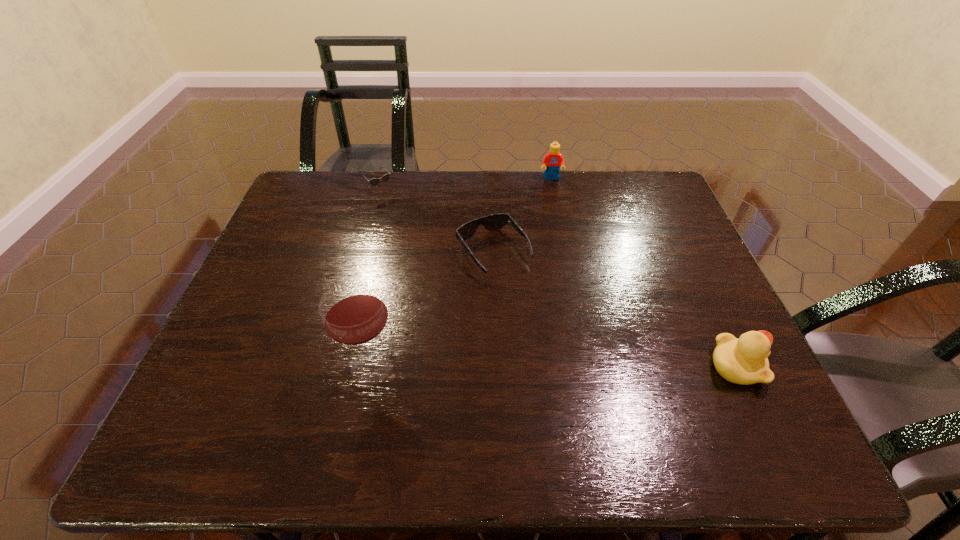
The width and height of the screenshot is (960, 540). I want to click on the tallest object, so click(x=354, y=313).

Locate an element on the screen. the rightmost object is located at coordinates (744, 361).

Locate an element on the screen. This screenshot has height=540, width=960. duckling is located at coordinates (744, 361).

Locate an element on the screen. the third object from left to right is located at coordinates (492, 222).

The height and width of the screenshot is (540, 960). Identify the location of the right sunglasses. (492, 222).

Find the location of a particular element. the fourth tallest object is located at coordinates (385, 178).

In order to click on the taller sunglasses in this screenshot , I will do `click(385, 178)`.

Locate an element on the screen. This screenshot has width=960, height=540. the fourth object from left to right is located at coordinates (552, 161).

The image size is (960, 540). Find the location of `Lego`. Lego is located at coordinates (552, 161).

Where is `vacant region located on the left of the wineglass`? The height and width of the screenshot is (540, 960). vacant region located on the left of the wineglass is located at coordinates (256, 367).